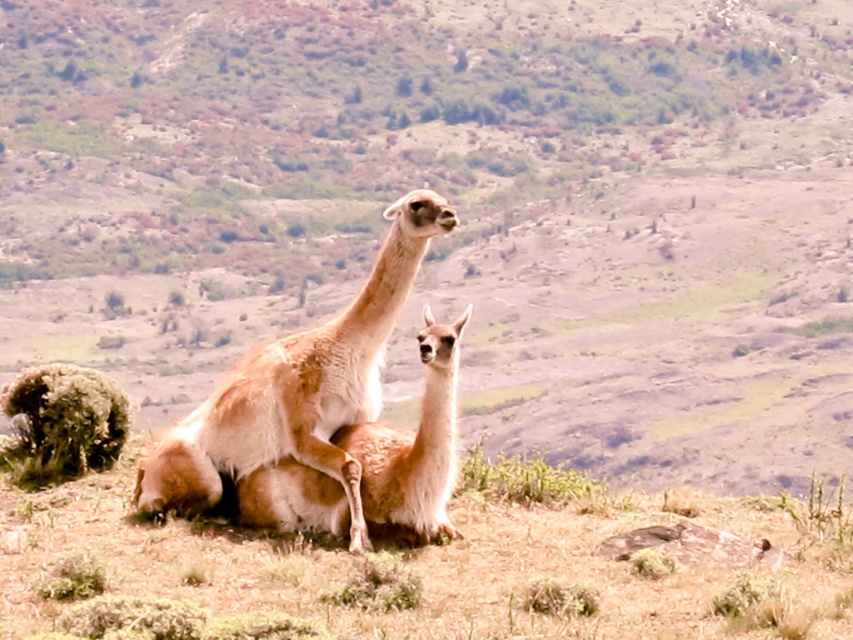
How far apart are dry grass at center and fuzzy brown alpaca at center?

The distance of dry grass at center from fuzzy brown alpaca at center is 25.34 inches.

Is dry grass at center bigger than fuzzy brown alpaca at center?

Yes, dry grass at center is bigger than fuzzy brown alpaca at center.

Which is in front, point (158, 595) or point (381, 513)?

Point (158, 595) is more forward.

Locate an element on the screen. This screenshot has height=640, width=853. dry grass at center is located at coordinates (422, 570).

Who is more forward, (x=268, y=596) or (x=389, y=314)?

Point (x=268, y=596) is in front.

Does point (834, 561) come farther from viewer compared to point (221, 403)?

That is False.

Where is `dry grass at center`? The image size is (853, 640). dry grass at center is located at coordinates (422, 570).

Does light brown woolen alpaca at center have a greater height compared to fuzzy brown alpaca at center?

Yes, light brown woolen alpaca at center is taller than fuzzy brown alpaca at center.

Measure the distance between light brown woolen alpaca at center and fuzzy brown alpaca at center.

light brown woolen alpaca at center and fuzzy brown alpaca at center are 8.95 inches apart.

Is point (308, 397) positioned in front of point (376, 449)?

No, it is not.

Where is `light brown woolen alpaca at center`? light brown woolen alpaca at center is located at coordinates (297, 387).